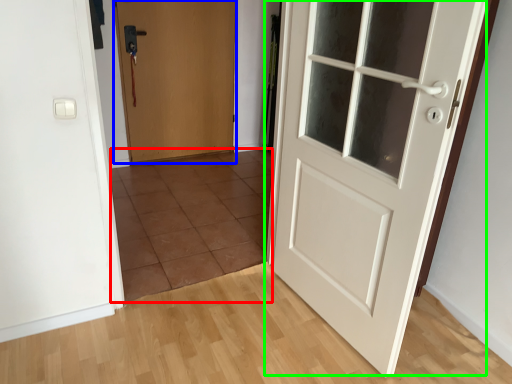
Question: Which object is the closest to the tile (highlighted by a red box)? Choose among these: door (highlighted by a blue box) or door (highlighted by a green box).

Choices:
 (A) door
 (B) door

Answer: (A)